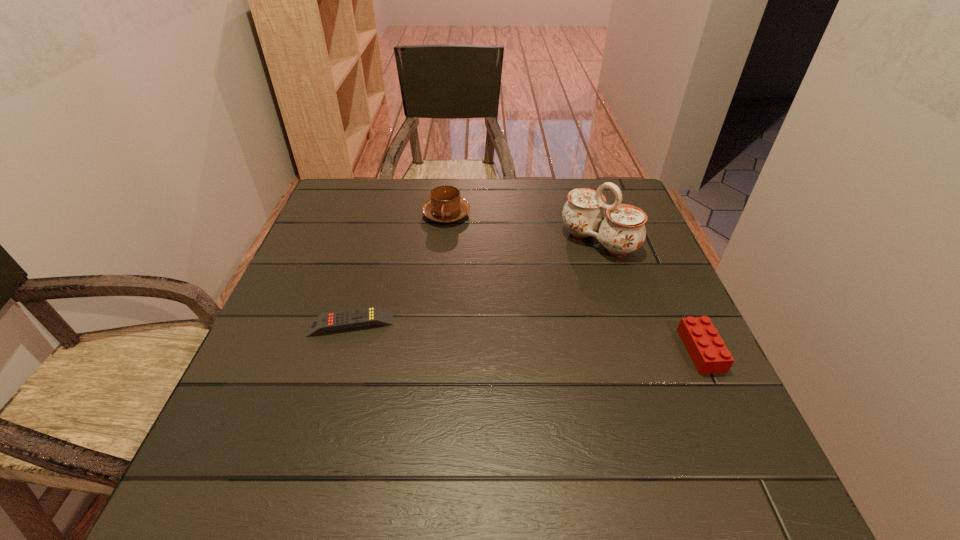
Locate an element on the screen. This screenshot has height=540, width=960. chinaware that is at the right edge is located at coordinates (622, 231).

The width and height of the screenshot is (960, 540). What are the coordinates of `object situated at the far right corner` in the screenshot? It's located at (622, 231).

Find the location of a particular element. vacant region at the far edge of the desktop is located at coordinates (501, 201).

You are a GUI agent. You are given a task and a screenshot of the screen. Output one action in this format:
    pyautogui.click(x=<x>, y=<y>)
    Task: Click on the free space at the near edge of the desktop
    The width and height of the screenshot is (960, 540).
    Given the screenshot: What is the action you would take?
    click(438, 408)

Identify the location of vacant space at the left edge. (367, 231).

In the image, there is a desktop. At what (x,y) coordinates should I click in order to perform the action: click on vacant area at the right edge. Please return your answer as a coordinate pair (x, y). The image size is (960, 540). Looking at the image, I should click on (644, 242).

The height and width of the screenshot is (540, 960). In order to click on vacant space at the far left corner in this screenshot , I will do `click(343, 208)`.

Identify the location of vacant position at the near left corner of the desktop. This screenshot has height=540, width=960. (301, 429).

The height and width of the screenshot is (540, 960). Identify the location of vacant position at the far right corner of the desktop. (586, 183).

This screenshot has width=960, height=540. In order to click on free point between the second object from right to left and the remote control in this screenshot , I will do `click(474, 282)`.